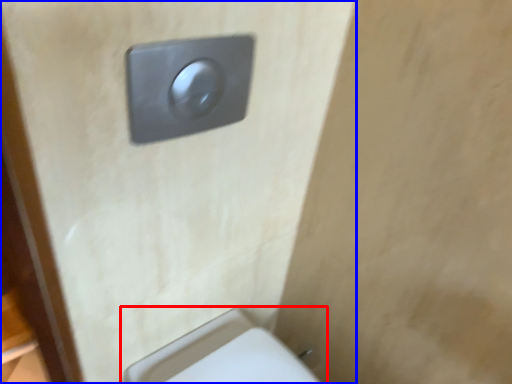
Question: Which point is closer to the camera, toilet (highlighted by a red box) or door (highlighted by a blue box)?

Choices:
 (A) toilet
 (B) door

Answer: (B)